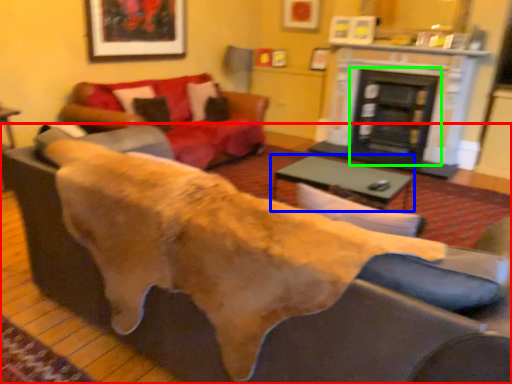
Question: Which is farther away from studio couch (highlighted by a red box)? table (highlighted by a blue box) or fireplace (highlighted by a green box)?

Choices:
 (A) table
 (B) fireplace

Answer: (B)